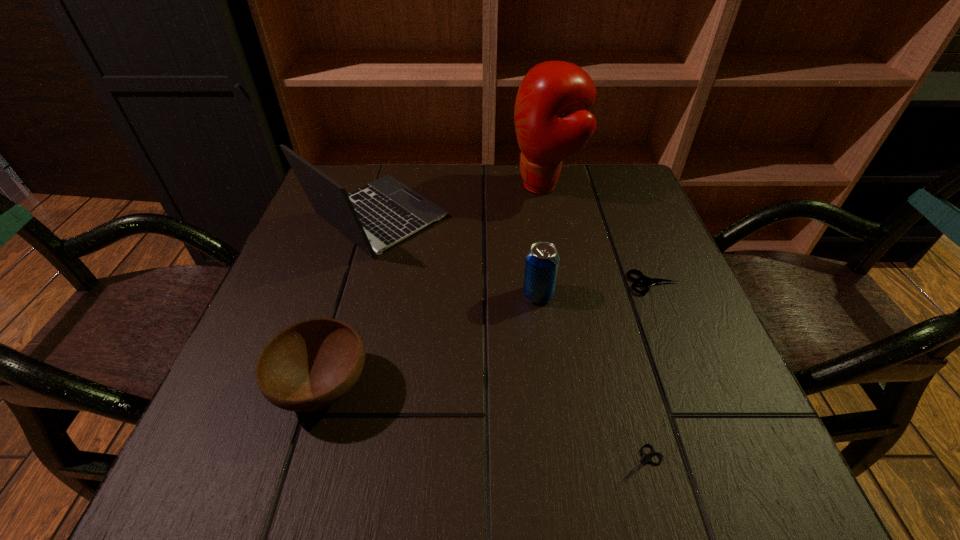
The image size is (960, 540). Find the location of `free space in the image that satisfies the following two spatial constraints: 1. on the striking surface of the right shears; 2. on the right side of the tallest object`. free space in the image that satisfies the following two spatial constraints: 1. on the striking surface of the right shears; 2. on the right side of the tallest object is located at coordinates (564, 283).

This screenshot has width=960, height=540. What are the coordinates of `free space that satisfies the following two spatial constraints: 1. on the back side of the left shears; 2. at the front screen of the laptop_computer` in the screenshot? It's located at (574, 217).